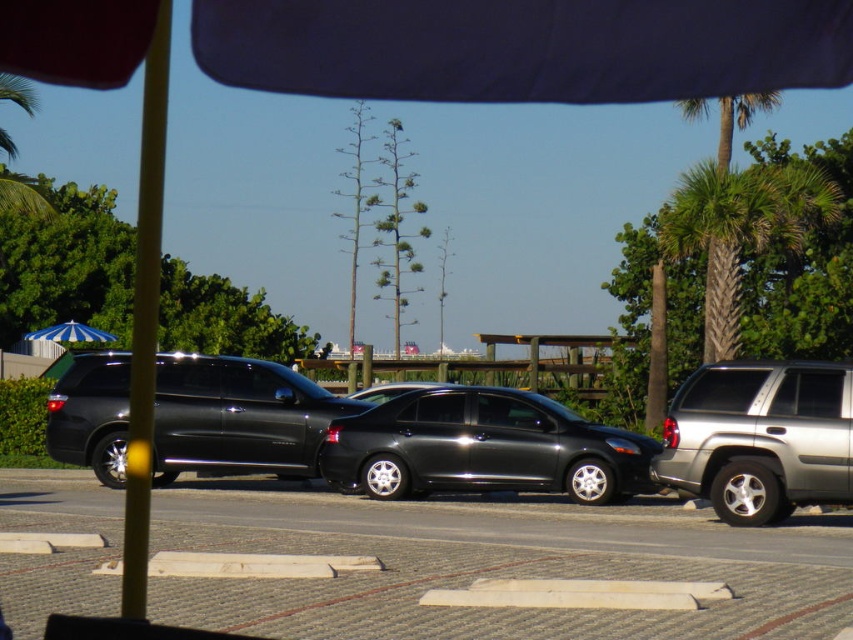
Question: Which of the following is the closest to the observer?

Choices:
 (A) (828, 420)
 (B) (323, 392)
 (C) (90, 340)
 (D) (308, 611)

Answer: (D)

Question: Estimate the real-world distances between objects in this image. Which object is closer to the green textured palm tree at right?

Choices:
 (A) silver metallic suv at right
 (B) matte black minivan at left
 (C) gray textured asphalt at center

Answer: (A)

Question: Among these objects, which one is nearest to the camera?

Choices:
 (A) matte black minivan at left
 (B) gray textured asphalt at center
 (C) glossy black sedan at center
 (D) green textured palm tree at right

Answer: (D)

Question: Is gray textured asphalt at center below blue striped umbrella at left?

Choices:
 (A) yes
 (B) no

Answer: (A)

Question: Is matte black minivan at left bigger than silver metallic suv at right?

Choices:
 (A) no
 (B) yes

Answer: (B)

Question: Is glossy black sedan at center above matte black minivan at left?

Choices:
 (A) no
 (B) yes

Answer: (A)